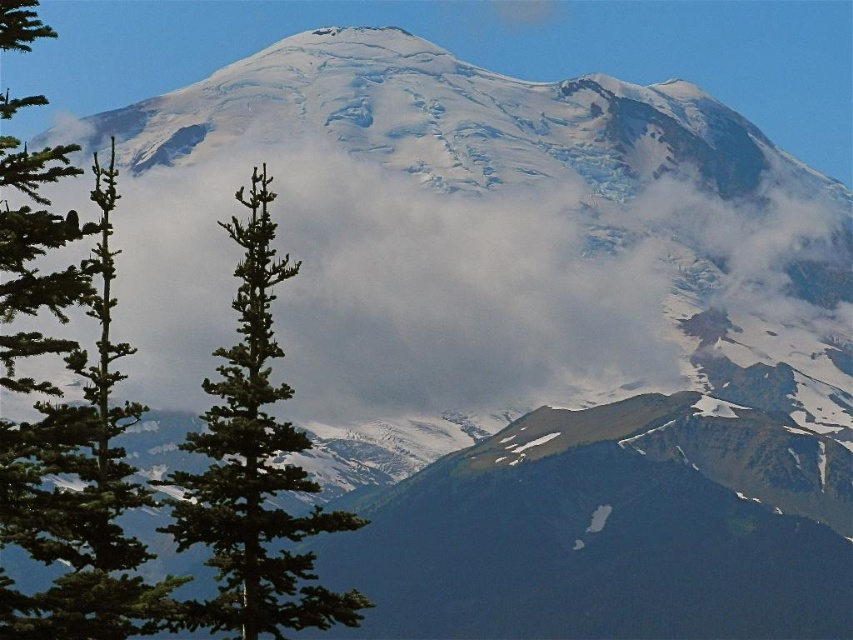
Between point (73, 449) and point (271, 508), which one is positioned behind?

The point (271, 508) is more distant.

Does green needle-like tree at left appear over green textured pine tree at center?

Yes, green needle-like tree at left is above green textured pine tree at center.

Does point (16, 490) come in front of point (209, 470)?

That is True.

What are the coordinates of `green needle-like tree at left` in the screenshot? It's located at (74, 465).